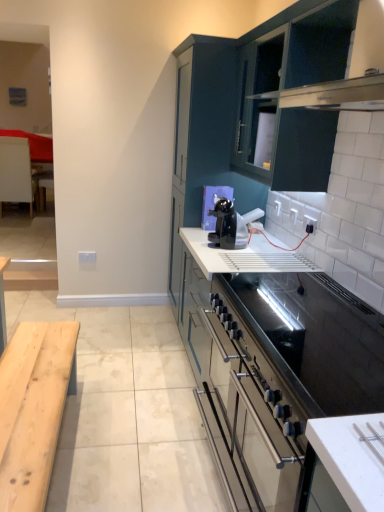
This screenshot has height=512, width=384. Describe the element at coordinates (293, 87) in the screenshot. I see `dark teal cabinet at upper center, marked as the 2th cabinetry in a back-to-front arrangement` at that location.

Describe the element at coordinates (309, 224) in the screenshot. I see `white glossy electric outlet at upper right, the 1th electric outlet when ordered from top to bottom` at that location.

What is the approximate width of white glossy electric outlet at upper right, the 1th electric outlet when ordered from top to bottom?

white glossy electric outlet at upper right, the 1th electric outlet when ordered from top to bottom, is 2.35 centimeters in width.

The height and width of the screenshot is (512, 384). What do you see at coordinates (16, 172) in the screenshot?
I see `white wood table at left` at bounding box center [16, 172].

Where is `white matte countertop at center`? Image resolution: width=384 pixels, height=512 pixels. white matte countertop at center is located at coordinates (309, 320).

At what (x,y) coordinates should I click in order to perform the action: click on dark teal cabinet at upper center, the first cabinetry positioned from the front. Please return your answer as a coordinate pair (x, y). The width and height of the screenshot is (384, 512). Looking at the image, I should click on (293, 87).

Is dark teal cabinet at upper center, the first cabinetry positioned from the front, situated inside white wood table at left or outside?

dark teal cabinet at upper center, the first cabinetry positioned from the front, is spatially situated outside white wood table at left.

Is the position of dark teal cabinet at upper center, marked as the 2th cabinetry in a back-to-front arrangement, more distant than that of white wood table at left?

That is False.

Could you tell me if dark teal cabinet at upper center, the first cabinetry positioned from the front, is facing white wood table at left?

No, dark teal cabinet at upper center, the first cabinetry positioned from the front, does not turn towards white wood table at left.

Who is smaller, dark teal cabinet at upper center, the first cabinetry positioned from the front, or white wood table at left?

With smaller size is white wood table at left.

How distant is matte dark blue cabinet at upper center, arranged as the 1th cabinetry when viewed from the back, from dark teal cabinet at upper center, the first cabinetry positioned from the front?

matte dark blue cabinet at upper center, arranged as the 1th cabinetry when viewed from the back, is 18.63 inches away from dark teal cabinet at upper center, the first cabinetry positioned from the front.

Does matte dark blue cabinet at upper center, arranged as the 1th cabinetry when viewed from the back, turn towards dark teal cabinet at upper center, marked as the 2th cabinetry in a back-to-front arrangement?

No, matte dark blue cabinet at upper center, arranged as the 1th cabinetry when viewed from the back, is not turned towards dark teal cabinet at upper center, marked as the 2th cabinetry in a back-to-front arrangement.

This screenshot has height=512, width=384. In order to click on cabinetry to the right of matte dark blue cabinet at upper center, arranged as the 1th cabinetry when viewed from the back in this screenshot , I will do [293, 87].

Is matte dark blue cabinet at upper center, the second cabinetry in the front-to-back sequence, wider or thinner than dark teal cabinet at upper center, the first cabinetry positioned from the front?

Considering their sizes, matte dark blue cabinet at upper center, the second cabinetry in the front-to-back sequence, looks broader than dark teal cabinet at upper center, the first cabinetry positioned from the front.

Considering the relative sizes of white glossy electric outlet at upper right, which is the first electric outlet from right to left, and white matte countertop at center in the image provided, is white glossy electric outlet at upper right, which is the first electric outlet from right to left, wider than white matte countertop at center?

No, white glossy electric outlet at upper right, which is the first electric outlet from right to left, is not wider than white matte countertop at center.

Measure the distance from white glossy electric outlet at upper right, which is the 2th electric outlet in back-to-front order, to white matte countertop at center.

They are 25.79 inches apart.

Which electric outlet is the 1st one when counting from the back of the white matte countertop at center? Please provide its 2D coordinates.

[(309, 224)]

Where is `the 1st electric outlet above the white matte countertop at center (from the image's perspective)`? The width and height of the screenshot is (384, 512). the 1st electric outlet above the white matte countertop at center (from the image's perspective) is located at coordinates (87, 257).

From a real-world perspective, is white matte countertop at center physically above white plastic electric outlet at center, which is the second electric outlet in right-to-left order?

Yes.

Is white matte countertop at center looking in the opposite direction of white plastic electric outlet at center, which is the second electric outlet in right-to-left order?

No, white matte countertop at center is not facing the opposite direction of white plastic electric outlet at center, which is the second electric outlet in right-to-left order.

Is white matte countertop at center thinner than white plastic electric outlet at center, which is the second electric outlet from front to back?

No, white matte countertop at center is not thinner than white plastic electric outlet at center, which is the second electric outlet from front to back.

In the image, is white matte countertop at center positioned in front of or behind matte dark blue cabinet at upper center, arranged as the 1th cabinetry when viewed from the back?

In the image, white matte countertop at center appears in front of matte dark blue cabinet at upper center, arranged as the 1th cabinetry when viewed from the back.

In terms of size, does white matte countertop at center appear bigger or smaller than matte dark blue cabinet at upper center, the second cabinetry in the front-to-back sequence?

In the image, white matte countertop at center appears to be smaller than matte dark blue cabinet at upper center, the second cabinetry in the front-to-back sequence.

From a real-world perspective, which cabinetry is the 1st one above the white matte countertop at center? Please provide its 2D coordinates.

[(200, 134)]

Which is correct: white matte countertop at center is inside dark teal cabinet at upper center, marked as the 2th cabinetry in a back-to-front arrangement, or outside of it?

white matte countertop at center cannot be found inside dark teal cabinet at upper center, marked as the 2th cabinetry in a back-to-front arrangement.

Is white matte countertop at center touching dark teal cabinet at upper center, the first cabinetry positioned from the front?

There is a gap between white matte countertop at center and dark teal cabinet at upper center, the first cabinetry positioned from the front.

Is white matte countertop at center oriented towards dark teal cabinet at upper center, the first cabinetry positioned from the front?

No, white matte countertop at center is not facing towards dark teal cabinet at upper center, the first cabinetry positioned from the front.

Find the location of a particular element. The image size is (384, 512). home appliance that is above the white glossy electric outlet at upper right, the second electric outlet viewed from the left (from the image's perspective) is located at coordinates (231, 224).

Is black glossy coffee machine at center not close to white glossy electric outlet at upper right, the 1th electric outlet viewed from the front?

No, black glossy coffee machine at center is not far from white glossy electric outlet at upper right, the 1th electric outlet viewed from the front.

Could you tell me if black glossy coffee machine at center is turned towards white glossy electric outlet at upper right, the second electric outlet viewed from the left?

No, black glossy coffee machine at center does not turn towards white glossy electric outlet at upper right, the second electric outlet viewed from the left.

Does black glossy coffee machine at center have a lesser width compared to white glossy electric outlet at upper right, the second electric outlet viewed from the left?

No.

You are a GUI agent. You are given a task and a screenshot of the screen. Output one action in this format:
    pyautogui.click(x=<x>, y=<y>)
    Task: Click on the 2nd cabinetry counting from the right of the white wood table at left
    This screenshot has width=384, height=512.
    Given the screenshot: What is the action you would take?
    pyautogui.click(x=293, y=87)

You are a GUI agent. You are given a task and a screenshot of the screen. Output one action in this format:
    pyautogui.click(x=<x>, y=<y>)
    Task: Click on the cabinetry above the matte dark blue cabinet at upper center, arranged as the 1th cabinetry when viewed from the back (from the image's perspective)
    
    Given the screenshot: What is the action you would take?
    pyautogui.click(x=293, y=87)

Estimate the real-world distances between objects in this image. Which object is closer to white wood table at left, white matte countertop at center or matte dark blue cabinet at upper center, the second cabinetry in the front-to-back sequence?

Among the two, matte dark blue cabinet at upper center, the second cabinetry in the front-to-back sequence, is located nearer to white wood table at left.

When comparing their distances from dark teal cabinet at upper center, the first cabinetry positioned from the front, does white wood table at left or white matte countertop at center seem further?

Among the two, white wood table at left is located further to dark teal cabinet at upper center, the first cabinetry positioned from the front.

Based on their spatial positions, is white wood table at left or dark teal cabinet at upper center, the first cabinetry positioned from the front, further from black glossy coffee machine at center?

white wood table at left.

Which object lies further to the anchor point white plastic electric outlet at center, which is the second electric outlet from top to bottom, white matte countertop at center or black glossy coffee machine at center?

Based on the image, white matte countertop at center appears to be further to white plastic electric outlet at center, which is the second electric outlet from top to bottom.

Estimate the real-world distances between objects in this image. Which object is closer to white matte countertop at center, white glossy electric outlet at upper right, the 1th electric outlet when ordered from top to bottom, or matte dark blue cabinet at upper center, arranged as the 1th cabinetry when viewed from the back?

white glossy electric outlet at upper right, the 1th electric outlet when ordered from top to bottom.

Estimate the real-world distances between objects in this image. Which object is further from white plastic electric outlet at center, the 1th electric outlet from the bottom, black glossy coffee machine at center or white glossy electric outlet at upper right, which appears as the second electric outlet when ordered from the bottom?

The object further to white plastic electric outlet at center, the 1th electric outlet from the bottom, is white glossy electric outlet at upper right, which appears as the second electric outlet when ordered from the bottom.

Based on their spatial positions, is white matte countertop at center or dark teal cabinet at upper center, marked as the 2th cabinetry in a back-to-front arrangement, closer to black glossy coffee machine at center?

white matte countertop at center.

Looking at this image, when comparing their distances from black glossy coffee machine at center, does matte dark blue cabinet at upper center, arranged as the 1th cabinetry when viewed from the back, or white glossy electric outlet at upper right, the 1th electric outlet when ordered from top to bottom, seem closer?

Based on the image, white glossy electric outlet at upper right, the 1th electric outlet when ordered from top to bottom, appears to be nearer to black glossy coffee machine at center.

Locate an element on the screen. The width and height of the screenshot is (384, 512). electric outlet between black glossy coffee machine at center and white wood table at left along the z-axis is located at coordinates (87, 257).

The height and width of the screenshot is (512, 384). What are the coordinates of `cabinetry located between dark teal cabinet at upper center, the first cabinetry positioned from the front, and white wood table at left in the depth direction` in the screenshot? It's located at (200, 134).

Locate an element on the screen. Image resolution: width=384 pixels, height=512 pixels. cabinetry positioned between white glossy electric outlet at upper right, which is the 2th electric outlet in back-to-front order, and white wood table at left from near to far is located at coordinates tap(200, 134).

Find the location of a particular element. The image size is (384, 512). home appliance between matte dark blue cabinet at upper center, arranged as the 1th cabinetry when viewed from the back, and white matte countertop at center, in the vertical direction is located at coordinates (231, 224).